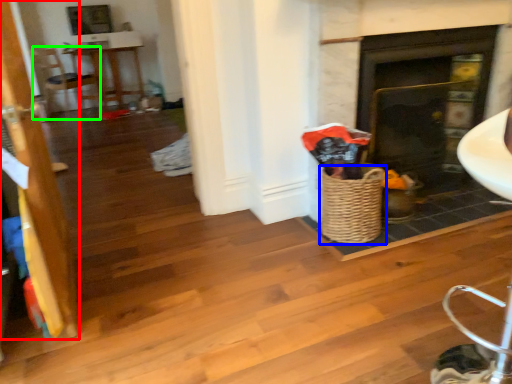
Question: Which is nearer to the door (highlighted by a red box)? basket (highlighted by a blue box) or armchair (highlighted by a green box).

Choices:
 (A) basket
 (B) armchair

Answer: (A)